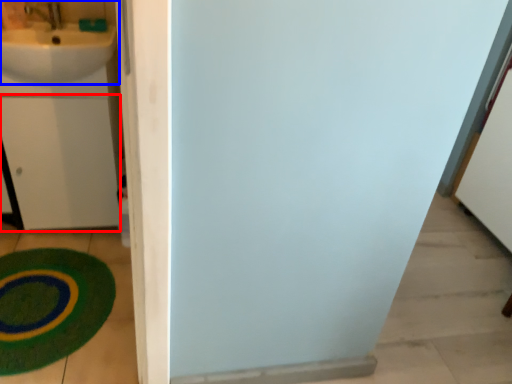
Question: Which point is further to the camera, drawer (highlighted by a red box) or sink (highlighted by a blue box)?

Choices:
 (A) drawer
 (B) sink

Answer: (A)